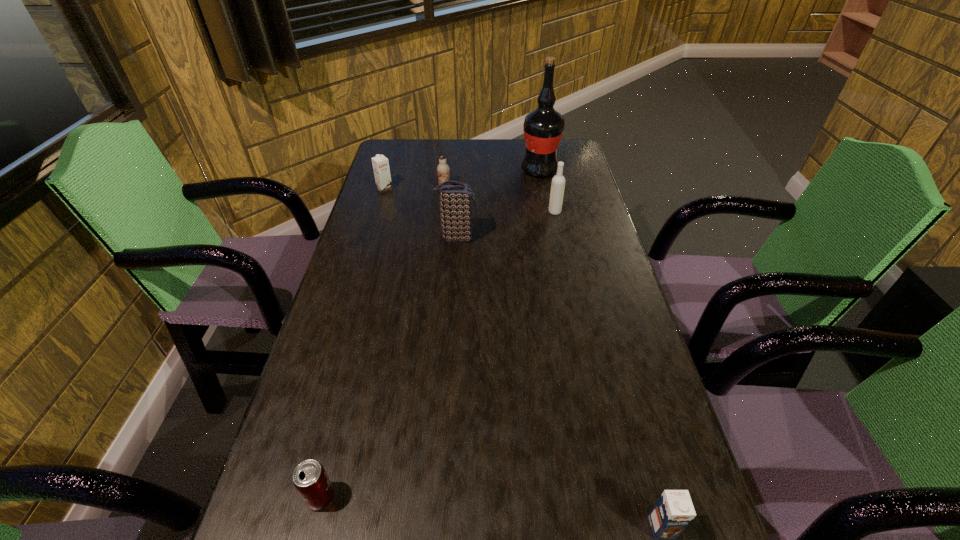
The image size is (960, 540). I want to click on wine bottle, so click(x=543, y=127).

Identify the location of the tallest object. The width and height of the screenshot is (960, 540). (543, 127).

Where is `the fifth farthest object`? the fifth farthest object is located at coordinates click(x=456, y=199).

Identify the location of vodka. This screenshot has width=960, height=540. (558, 182).

Where is `the leftmost chocolate milk`? This screenshot has width=960, height=540. the leftmost chocolate milk is located at coordinates (380, 163).

Find the location of a particular element. This screenshot has height=540, width=960. the second chocolate milk from right to left is located at coordinates (x=443, y=169).

The height and width of the screenshot is (540, 960). In order to click on the nearest chocolate milk in this screenshot , I will do `click(674, 510)`.

Find the location of a particular element. The image size is (960, 540). the rightmost chocolate milk is located at coordinates (674, 510).

Locate an element on the screen. the second nearest object is located at coordinates click(x=310, y=479).

The image size is (960, 540). I want to click on free location located on the left of the farthest object, so click(x=426, y=171).